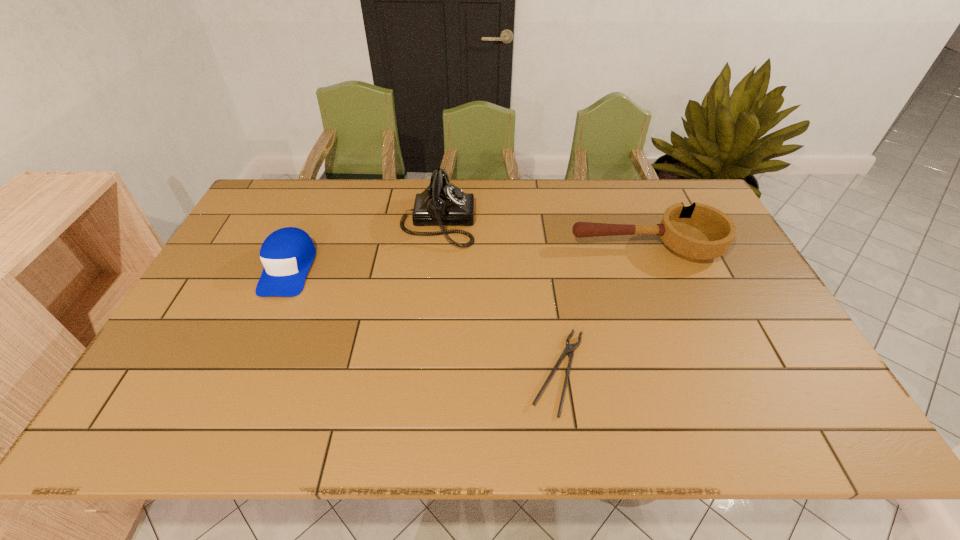
Identify the location of vacant space at the far right corner of the desktop. (689, 191).

Find the location of a particular element. empty space between the saucepan and the baseball cap is located at coordinates (x=468, y=258).

Find the location of a particular element. vacant area that lies between the leftmost object and the rightmost object is located at coordinates (468, 258).

Identify the location of vacant space that's between the leftmost object and the tongs. The image size is (960, 540). (423, 320).

Identify the location of free space between the third object from left to right and the second object from left to right. point(498,297).

Identify the location of empty space that is in between the tongs and the telephone. Image resolution: width=960 pixels, height=540 pixels. (498, 297).

Identify the location of free space between the second object from left to right and the leftmost object. (363, 245).

Locate an element on the screen. Image resolution: width=960 pixels, height=540 pixels. free space between the shortest object and the tallest object is located at coordinates (498, 297).

Locate an element on the screen. The height and width of the screenshot is (540, 960). empty space that is in between the rightmost object and the nearest object is located at coordinates (602, 309).

This screenshot has height=540, width=960. Identify the location of free space that is in between the rightmost object and the baseball cap. (468, 258).